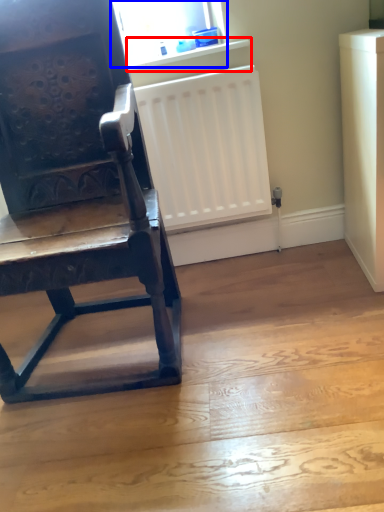
Question: Which object appears closest to the camera in this image, window sill (highlighted by a red box) or window screen (highlighted by a blue box)?

Choices:
 (A) window sill
 (B) window screen

Answer: (B)